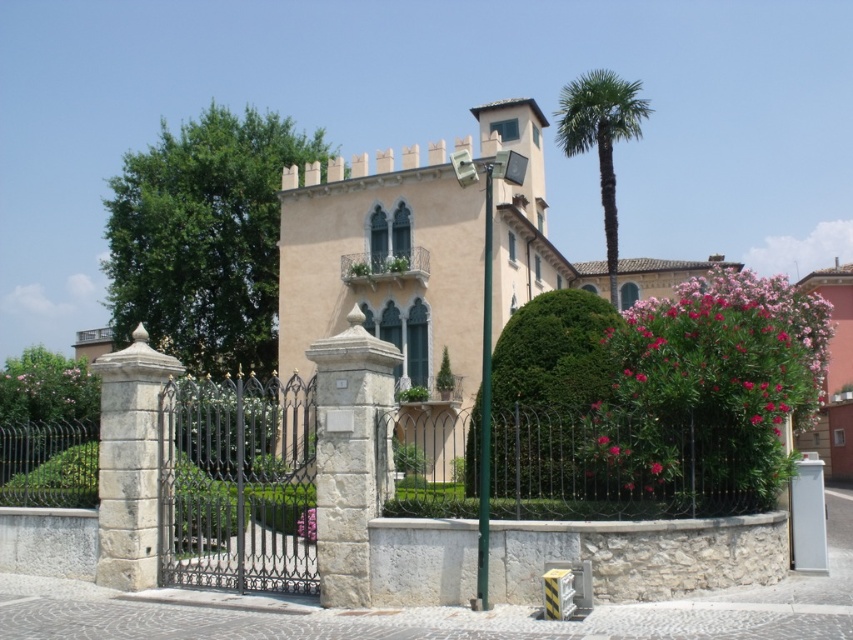
Who is lower down, green leafy palm at upper right or pink matte flower at center-right?

pink matte flower at center-right is below.

The width and height of the screenshot is (853, 640). Describe the element at coordinates (601, 138) in the screenshot. I see `green leafy palm at upper right` at that location.

At what (x,y) coordinates should I click in order to perform the action: click on green leafy palm at upper right. Please return your answer as a coordinate pair (x, y). Looking at the image, I should click on (601, 138).

Can you confirm if green leafy tree at upper left is positioned below pink matte flower at right?

No, green leafy tree at upper left is not below pink matte flower at right.

Is green leafy tree at upper left positioned behind pink matte flower at right?

Yes, it is behind pink matte flower at right.

Where is `green leafy tree at upper left`? This screenshot has height=640, width=853. green leafy tree at upper left is located at coordinates (204, 237).

Identify the location of green leafy tree at upper left. (204, 237).

Which is behind, point (247, 461) or point (485, 486)?

The point (247, 461) is more distant.

Is black wrought iron gate at center further to camera compared to green metallic pole at center?

Yes, it is behind green metallic pole at center.

Locate an element on the screen. black wrought iron gate at center is located at coordinates (236, 483).

The width and height of the screenshot is (853, 640). Find the location of `black wrought iron gate at center`. black wrought iron gate at center is located at coordinates (236, 483).